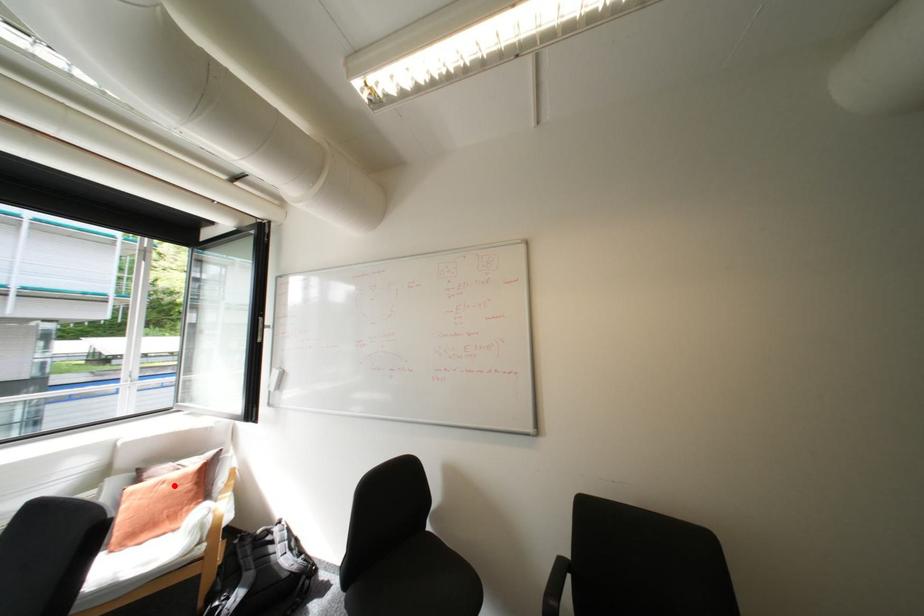
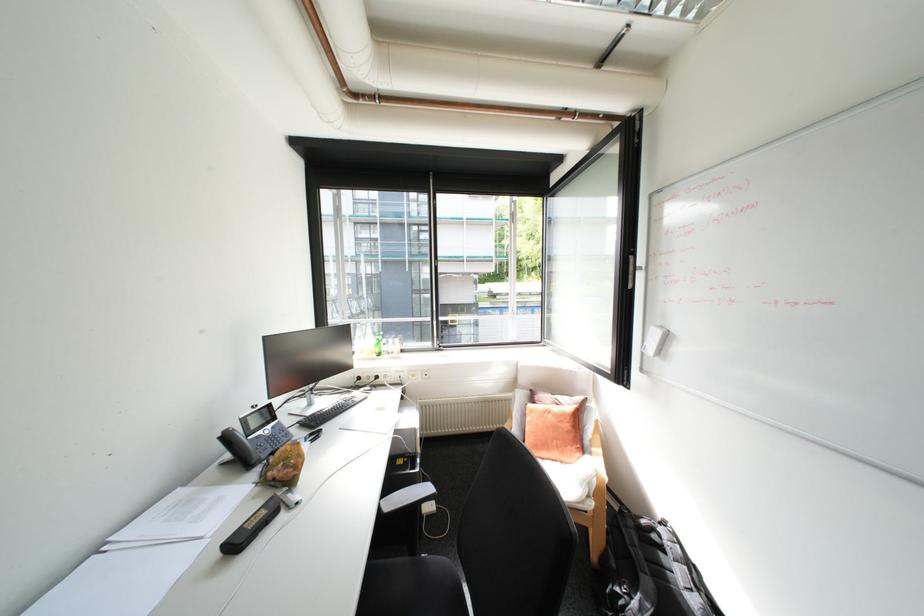
Question: I am providing you with two images of the same scene from different viewpoints. In image1, a red point is highlighted. Considering the same 3D point in image2, which of the following is correct?

Choices:
 (A) It is closer
 (B) It is farther

Answer: (B)